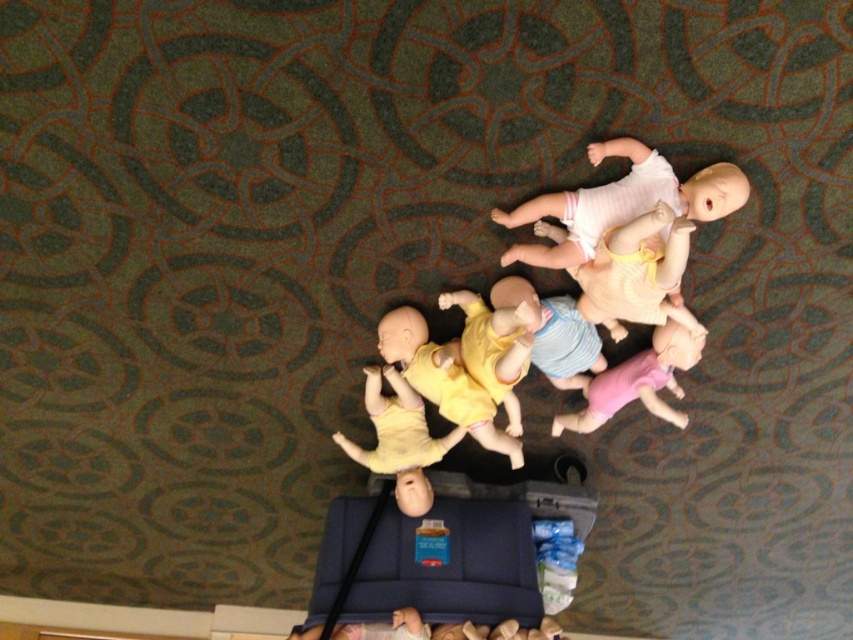
You are a first aid trainer preparing materials for a class. You have a storage box that can only fit items narrower than 30 cm. You see the light pink fabric baby doll at upper right and the yellow matte doll at center. Which doll can fit into the storage box?

The light pink fabric baby doll at upper right has a smaller width than the yellow matte doll at center, so it can fit into the storage box if its width is under 30 cm. However, without knowing the exact width of the light pink doll, we can only conclude it is narrower than the yellow one. If the yellow doll exceeds 30 cm, then neither may fit. But based on the given information, the light pink one is more likely to fit due to its smaller size.

You are a first aid trainer who needs to locate the white matte baby doll at upper right for a demonstration. According to the coordinates provided, where exactly should you look on the image to find it?

The white matte baby doll at upper right is located at point coordinates (621, 202) on the image.

You are a trainee nurse who needs to locate the light pink fabric baby doll at upper right for a CPR training exercise. According to the coordinates provided, where exactly should you look on the image to find it?

The light pink fabric baby doll at upper right is located at point (637, 273) on the image.